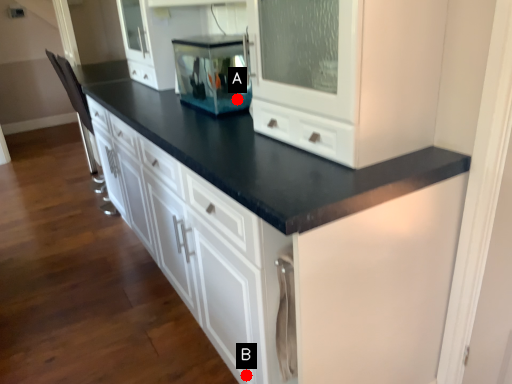
Question: Two points are circled on the image, labeled by A and B beside each circle. Which point is closer to the camera taking this photo?

Choices:
 (A) A is closer
 (B) B is closer

Answer: (B)